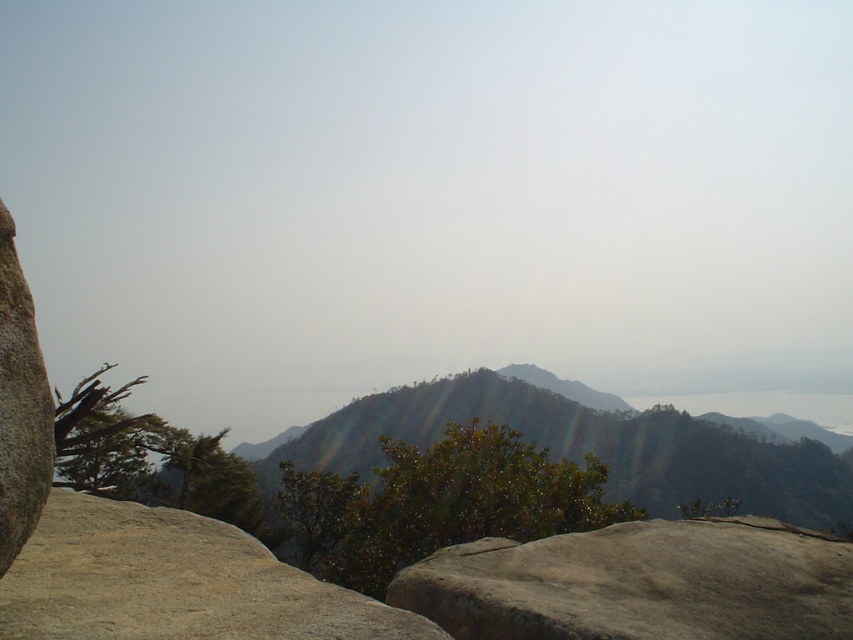
Which is more to the left, smooth gray rock at center or smooth beige rock at lower left?

smooth beige rock at lower left

From the picture: Who is shorter, smooth gray rock at center or smooth beige rock at lower left?

Standing shorter between the two is smooth beige rock at lower left.

Between point (654, 545) and point (131, 508), which one is positioned in front?

Point (131, 508) is more forward.

Locate an element on the screen. This screenshot has width=853, height=640. smooth gray rock at center is located at coordinates [639, 582].

Does smooth beige rock at lower left have a lesser height compared to green leafy mountain at center?

Yes, smooth beige rock at lower left is shorter than green leafy mountain at center.

Can you confirm if smooth beige rock at lower left is taller than green leafy mountain at center?

No.

The image size is (853, 640). Describe the element at coordinates (173, 582) in the screenshot. I see `smooth beige rock at lower left` at that location.

Where is `smooth beige rock at lower left`? smooth beige rock at lower left is located at coordinates pos(173,582).

Does point (654, 561) lie behind point (358, 426)?

That is False.

This screenshot has height=640, width=853. I want to click on smooth gray rock at center, so [x=639, y=582].